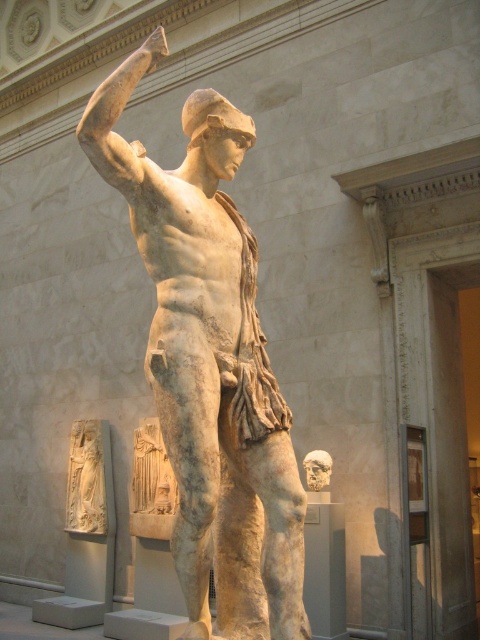
You are an art student standing in front of the white marble statue at center and the white marble relief at lower left. Which object is positioned to the right of the other?

The white marble statue at center is to the right of the white marble relief at lower left.

Consider the image. You are an art conservator examining the classical marble statue. You notice that the white marble statue at center and the matte stone head at center have different textures. Which object is positioned to the right side?

The matte stone head at center is positioned to the right of the white marble statue at center.

You are an art conservator examining the image. You need to determine if the white marble statue at center is resting on the white marble relief at lower left. Can you confirm this based on the spatial arrangement?

The white marble statue at center is positioned over white marble relief at lower left, which means the statue is indeed resting on the relief.